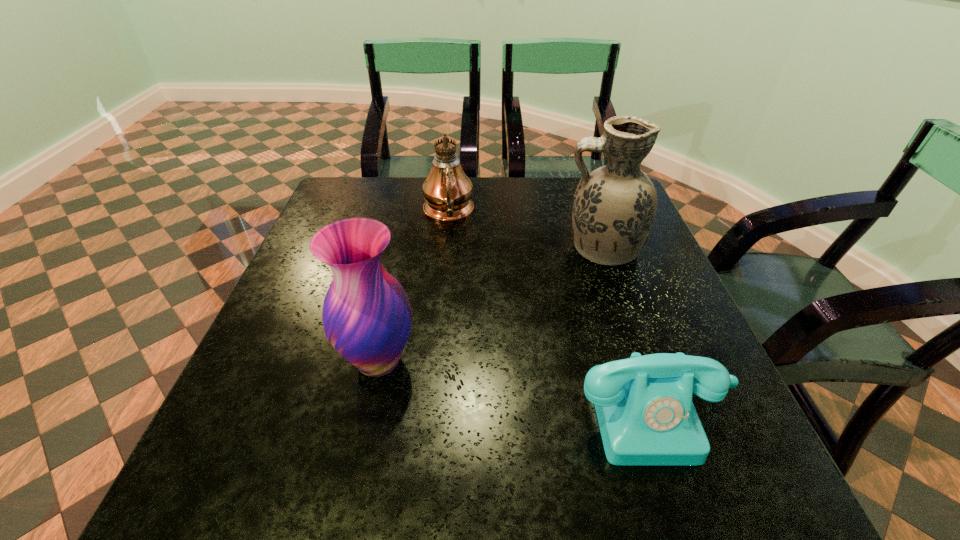
Where is `object that is at the far edge`? The height and width of the screenshot is (540, 960). object that is at the far edge is located at coordinates (447, 190).

The width and height of the screenshot is (960, 540). Find the location of `object at the near edge`. object at the near edge is located at coordinates (646, 416).

The image size is (960, 540). I want to click on vase that is positioned at the right edge, so click(614, 208).

At what (x,y) coordinates should I click in order to perform the action: click on telephone situated at the right edge. Please return your answer as a coordinate pair (x, y). Looking at the image, I should click on click(x=646, y=416).

Image resolution: width=960 pixels, height=540 pixels. Find the location of `object present at the near right corner`. object present at the near right corner is located at coordinates (646, 416).

Image resolution: width=960 pixels, height=540 pixels. I want to click on free spot at the far edge of the desktop, so click(x=393, y=214).

Locate an element on the screen. The height and width of the screenshot is (540, 960). free space at the near edge is located at coordinates (327, 486).

I want to click on vacant region at the left edge of the desktop, so click(x=306, y=255).

Where is `vacant space at the right edge of the desktop`? The image size is (960, 540). vacant space at the right edge of the desktop is located at coordinates (696, 337).

At what (x,y) coordinates should I click in order to perform the action: click on vacant point at the far left corner. Please return your answer as a coordinate pair (x, y). Image resolution: width=960 pixels, height=540 pixels. Looking at the image, I should click on (368, 188).